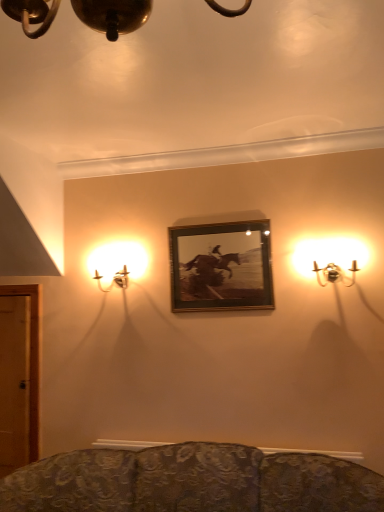
This screenshot has width=384, height=512. What are the coordinates of `metallic gold sconce at left, the second lamp positioned from the right` in the screenshot? It's located at (117, 264).

What do you see at coordinates (330, 259) in the screenshot?
I see `metallic wall sconce at right, positioned as the second lamp in left-to-right order` at bounding box center [330, 259].

The height and width of the screenshot is (512, 384). I want to click on metallic gold sconce at left, which is the first lamp in left-to-right order, so click(x=117, y=264).

Which point is more distant from viewer, [130,248] or [325,274]?

The point [130,248] is farther from the camera.

From a real-world perspective, is metallic gold sconce at left, the second lamp positioned from the right, positioned over metallic wall sconce at right, positioned as the second lamp in left-to-right order, based on gravity?

Yes.

From the image's perspective, relative to metallic wall sconce at right, acting as the first lamp starting from the right, is metallic gold sconce at left, arranged as the second lamp when viewed from the front, above or below?

metallic gold sconce at left, arranged as the second lamp when viewed from the front, is situated lower than metallic wall sconce at right, acting as the first lamp starting from the right, in the image.

Considering the relative sizes of metallic gold sconce at left, the second lamp positioned from the right, and metallic wall sconce at right, which appears as the 2th lamp when viewed from the back, in the image provided, is metallic gold sconce at left, the second lamp positioned from the right, shorter than metallic wall sconce at right, which appears as the 2th lamp when viewed from the back,?

No, metallic gold sconce at left, the second lamp positioned from the right, is not shorter than metallic wall sconce at right, which appears as the 2th lamp when viewed from the back.

Is metallic gold sconce at left, the 1th lamp viewed from the back, turned away from wooden frame at center?

metallic gold sconce at left, the 1th lamp viewed from the back, does not have its back to wooden frame at center.

In the image, is metallic gold sconce at left, the second lamp positioned from the right, on the left side or the right side of wooden frame at center?

metallic gold sconce at left, the second lamp positioned from the right, is to the left of wooden frame at center.

Which is less distant, (101, 272) or (185, 241)?

Point (185, 241)

From the image's perspective, which one is positioned lower, metallic gold sconce at left, arranged as the second lamp when viewed from the front, or wooden frame at center?

From the image's view, metallic gold sconce at left, arranged as the second lamp when viewed from the front, is below.

From a real-world perspective, which object stands above the other?

wooden frame at center is physically above.

Between point (337, 263) and point (213, 282), which one is positioned in front?

The point (337, 263) is more forward.

Is metallic wall sconce at right, positioned as the second lamp in left-to-right order, taller or shorter than wooden frame at center?

Clearly, metallic wall sconce at right, positioned as the second lamp in left-to-right order, is shorter compared to wooden frame at center.

Could you tell me if metallic wall sconce at right, marked as the first lamp in a front-to-back arrangement, is turned towards wooden frame at center?

No, metallic wall sconce at right, marked as the first lamp in a front-to-back arrangement, is not aimed at wooden frame at center.

Does wooden frame at center have a lesser width compared to metallic gold sconce at left, the 1th lamp viewed from the back?

Yes, wooden frame at center is thinner than metallic gold sconce at left, the 1th lamp viewed from the back.

Is the position of wooden frame at center more distant than that of metallic gold sconce at left, arranged as the second lamp when viewed from the front?

No, wooden frame at center is closer to the camera.

From a real-world perspective, is wooden frame at center on top of metallic gold sconce at left, the second lamp positioned from the right?

Indeed, from a real-world perspective, wooden frame at center stands above metallic gold sconce at left, the second lamp positioned from the right.

Which object is positioned more to the left, metallic wall sconce at right, positioned as the second lamp in left-to-right order, or metallic gold sconce at left, the 1th lamp viewed from the back?

metallic gold sconce at left, the 1th lamp viewed from the back.

Could you measure the distance between metallic wall sconce at right, marked as the first lamp in a front-to-back arrangement, and metallic gold sconce at left, which is the first lamp in left-to-right order?

metallic wall sconce at right, marked as the first lamp in a front-to-back arrangement, and metallic gold sconce at left, which is the first lamp in left-to-right order, are 1.11 meters apart from each other.

Does metallic wall sconce at right, which appears as the 2th lamp when viewed from the back, touch metallic gold sconce at left, which is the first lamp in left-to-right order?

metallic wall sconce at right, which appears as the 2th lamp when viewed from the back, is not next to metallic gold sconce at left, which is the first lamp in left-to-right order, and they're not touching.

Between metallic wall sconce at right, acting as the first lamp starting from the right, and metallic gold sconce at left, which is the first lamp in left-to-right order, which one is positioned behind?

metallic gold sconce at left, which is the first lamp in left-to-right order.

From the image's perspective, is wooden frame at center beneath metallic wall sconce at right, which appears as the 2th lamp when viewed from the back?

Yes, from the image's perspective, wooden frame at center is beneath metallic wall sconce at right, which appears as the 2th lamp when viewed from the back.

Does wooden frame at center have a smaller size compared to metallic wall sconce at right, marked as the first lamp in a front-to-back arrangement?

Yes.

Could you measure the distance between wooden frame at center and metallic wall sconce at right, positioned as the second lamp in left-to-right order?

16.32 inches.

Between wooden frame at center and metallic wall sconce at right, positioned as the second lamp in left-to-right order, which one appears on the left side from the viewer's perspective?

wooden frame at center.

The image size is (384, 512). Find the location of `lamp on the right of metallic gold sconce at left, the 1th lamp viewed from the back`. lamp on the right of metallic gold sconce at left, the 1th lamp viewed from the back is located at coordinates (330, 259).

The width and height of the screenshot is (384, 512). In order to click on lamp behind the wooden frame at center in this screenshot , I will do `click(117, 264)`.

Which object lies nearer to the anchor point metallic gold sconce at left, the second lamp positioned from the right, metallic wall sconce at right, positioned as the second lamp in left-to-right order, or wooden frame at center?

wooden frame at center is positioned closer to the anchor metallic gold sconce at left, the second lamp positioned from the right.

Based on their spatial positions, is metallic gold sconce at left, which is the first lamp in left-to-right order, or wooden frame at center further from metallic wall sconce at right, marked as the first lamp in a front-to-back arrangement?

metallic gold sconce at left, which is the first lamp in left-to-right order, is further to metallic wall sconce at right, marked as the first lamp in a front-to-back arrangement.

Considering their positions, is metallic gold sconce at left, arranged as the second lamp when viewed from the front, positioned closer to wooden frame at center than metallic wall sconce at right, positioned as the second lamp in left-to-right order?

metallic wall sconce at right, positioned as the second lamp in left-to-right order, lies closer to wooden frame at center than the other object.

Consider the image. Considering their positions, is wooden frame at center positioned closer to metallic wall sconce at right, which appears as the 2th lamp when viewed from the back, than metallic gold sconce at left, arranged as the second lamp when viewed from the front?

The object closer to metallic wall sconce at right, which appears as the 2th lamp when viewed from the back, is wooden frame at center.

Estimate the real-world distances between objects in this image. Which object is further from metallic gold sconce at left, which is the first lamp in left-to-right order, wooden frame at center or metallic wall sconce at right, which appears as the 2th lamp when viewed from the back?

metallic wall sconce at right, which appears as the 2th lamp when viewed from the back, is positioned further to the anchor metallic gold sconce at left, which is the first lamp in left-to-right order.

From the image, which object appears to be nearer to wooden frame at center, metallic wall sconce at right, positioned as the second lamp in left-to-right order, or metallic gold sconce at left, the 1th lamp viewed from the back?

metallic wall sconce at right, positioned as the second lamp in left-to-right order, is closer to wooden frame at center.

Where is `picture frame between metallic gold sconce at left, the second lamp positioned from the right, and metallic wall sconce at right, which appears as the 2th lamp when viewed from the back, from left to right`? This screenshot has height=512, width=384. picture frame between metallic gold sconce at left, the second lamp positioned from the right, and metallic wall sconce at right, which appears as the 2th lamp when viewed from the back, from left to right is located at coordinates (221, 267).